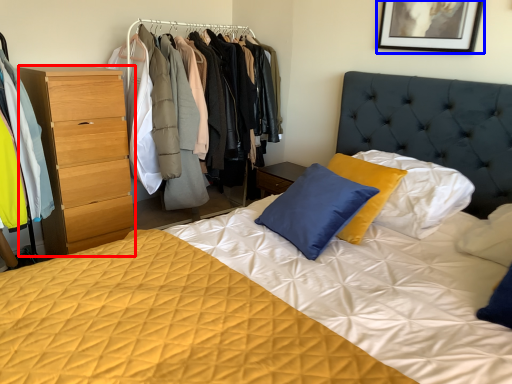
Question: Among these objects, which one is nearest to the camera, chest of drawers (highlighted by a red box) or picture frame (highlighted by a blue box)?

Choices:
 (A) chest of drawers
 (B) picture frame

Answer: (B)